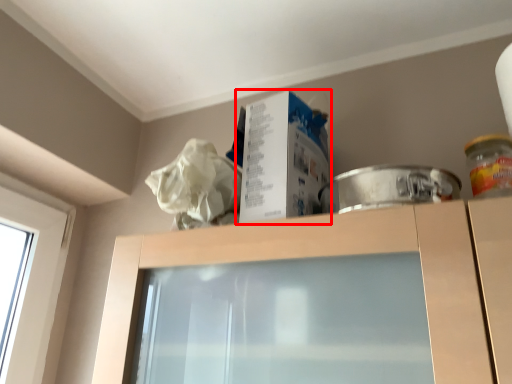
Question: From the image, what is the correct spatial relationship of box (annotated by the red box) in relation to glass jar?

Choices:
 (A) left
 (B) right

Answer: (A)